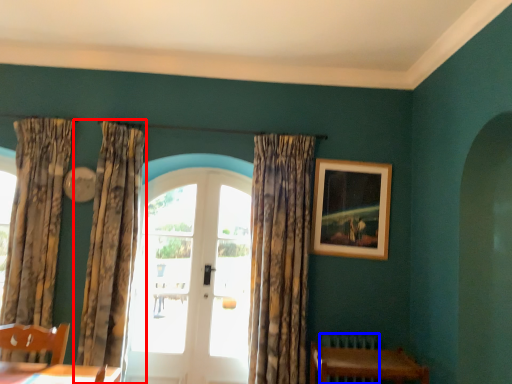
Question: Which point is closer to the camera, curtain (highlighted by a red box) or radiator (highlighted by a blue box)?

Choices:
 (A) curtain
 (B) radiator

Answer: (A)